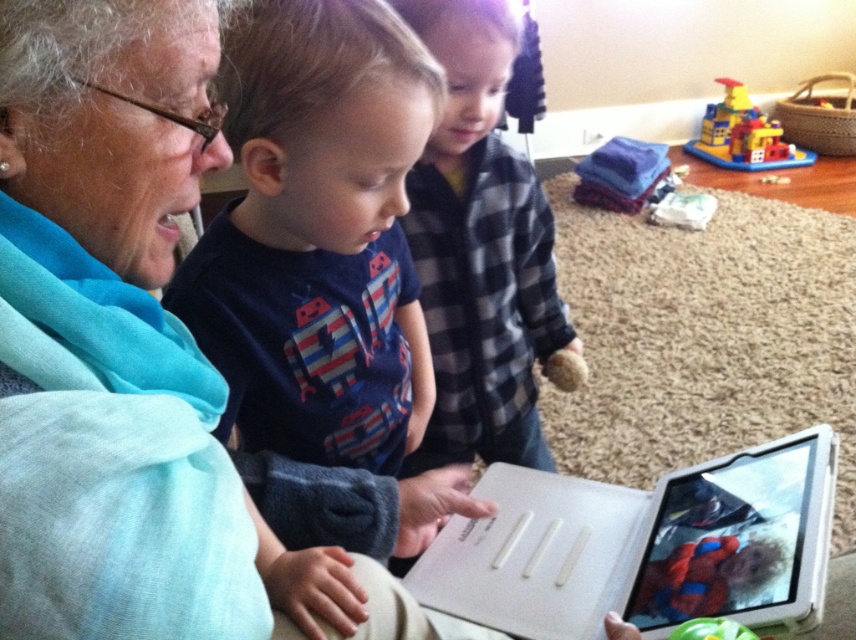
You are holding a camera and want to take a closeup shot of the matte blue scarf at upper left. The camera is currently 12.16 inches away from the scarf. If you move the camera 3 inches closer, will the scarf fill more of the frame?

Yes, moving the camera 3 inches closer to the matte blue scarf at upper left would reduce the distance from 12.16 inches to 9.16 inches. Since the scarf is now closer to the camera, it would occupy a larger portion of the frame, making it fill more of the shot.

You are a photographer trying to capture a group photo of the matte blue shirt at center and the plaid flannel shirt at center. Which child should you position to the left to maintain their current spatial arrangement?

The matte blue shirt at center should be positioned to the left of the plaid flannel shirt at center to maintain their current spatial arrangement.